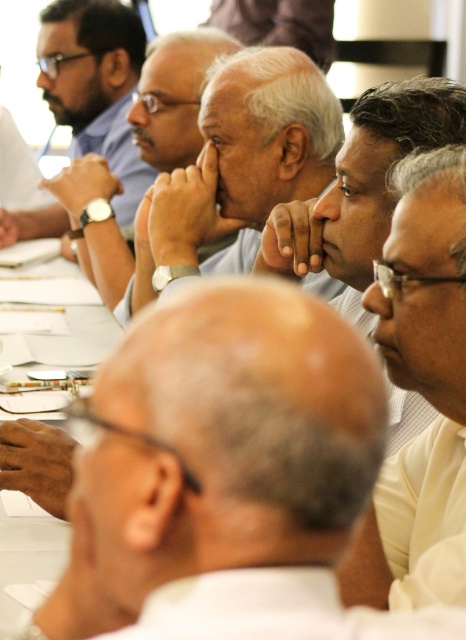
Is matte black watch at upper left positioned behind white paper at center?

Yes.

The width and height of the screenshot is (466, 640). Describe the element at coordinates (95, 83) in the screenshot. I see `matte black watch at upper left` at that location.

Image resolution: width=466 pixels, height=640 pixels. I want to click on matte black watch at upper left, so click(95, 83).

Which is more to the right, gray matte shirt at center or white paper at center?

From the viewer's perspective, gray matte shirt at center appears more on the right side.

Image resolution: width=466 pixels, height=640 pixels. What do you see at coordinates (239, 166) in the screenshot?
I see `gray matte shirt at center` at bounding box center [239, 166].

Where is `gray matte shirt at center`? Image resolution: width=466 pixels, height=640 pixels. gray matte shirt at center is located at coordinates (239, 166).

Can you confirm if gray matte shirt at center is thinner than matte black watch at upper left?

No.

Looking at this image, who is more forward, (x=203, y=120) or (x=136, y=184)?

Point (x=203, y=120) is more forward.

I want to click on gray matte shirt at center, so click(239, 166).